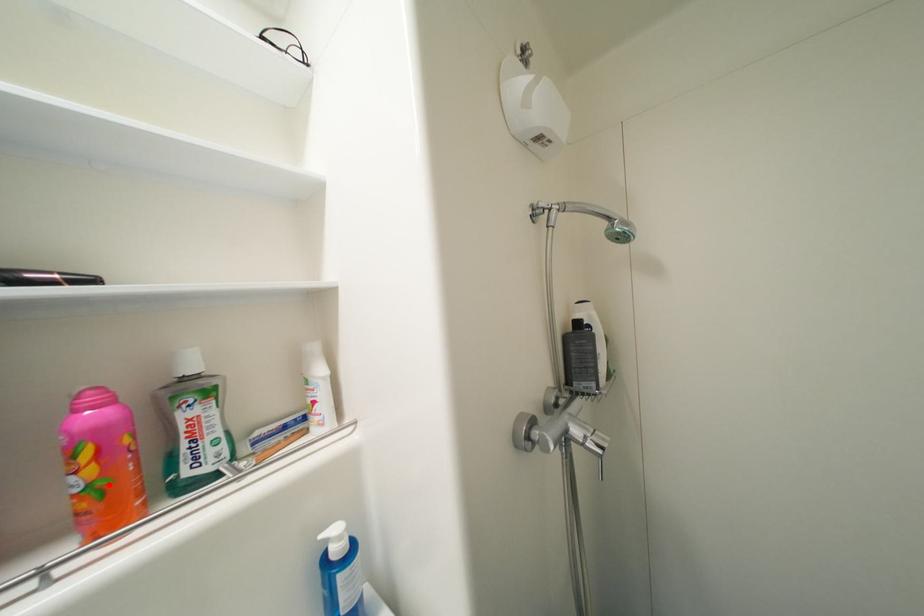
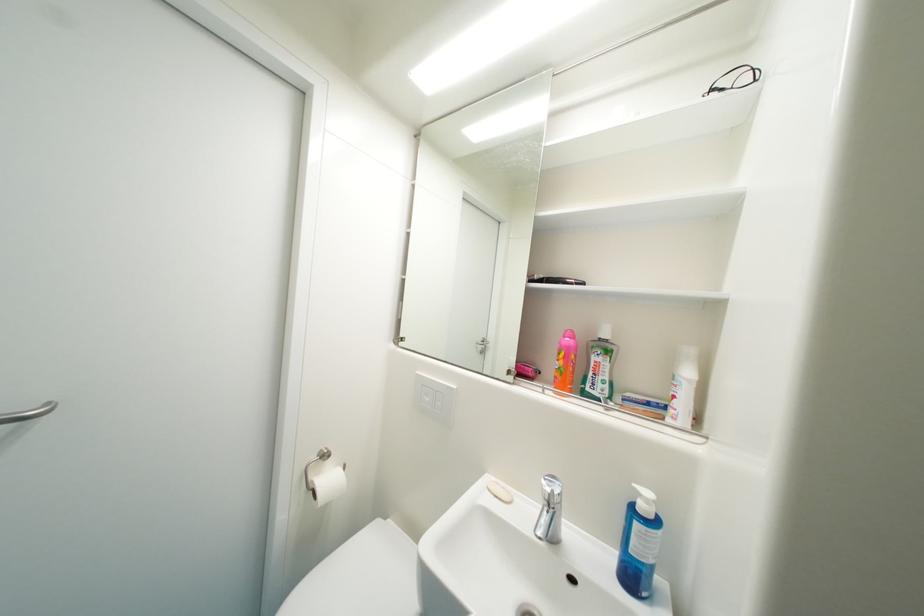
Locate, in the second image, the point that corresponds to the highlighted location in the first image.

(569, 371)